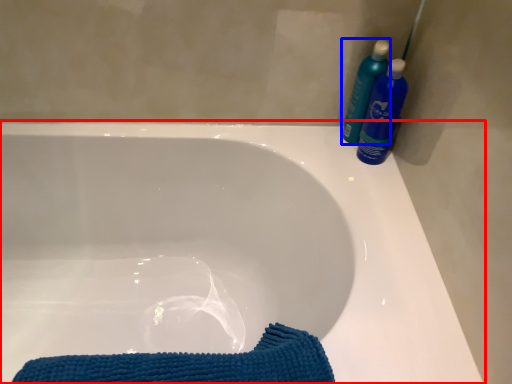
Question: Which of the following is the farthest to the observer, bathtub (highlighted by a red box) or cleaning product (highlighted by a blue box)?

Choices:
 (A) bathtub
 (B) cleaning product

Answer: (B)